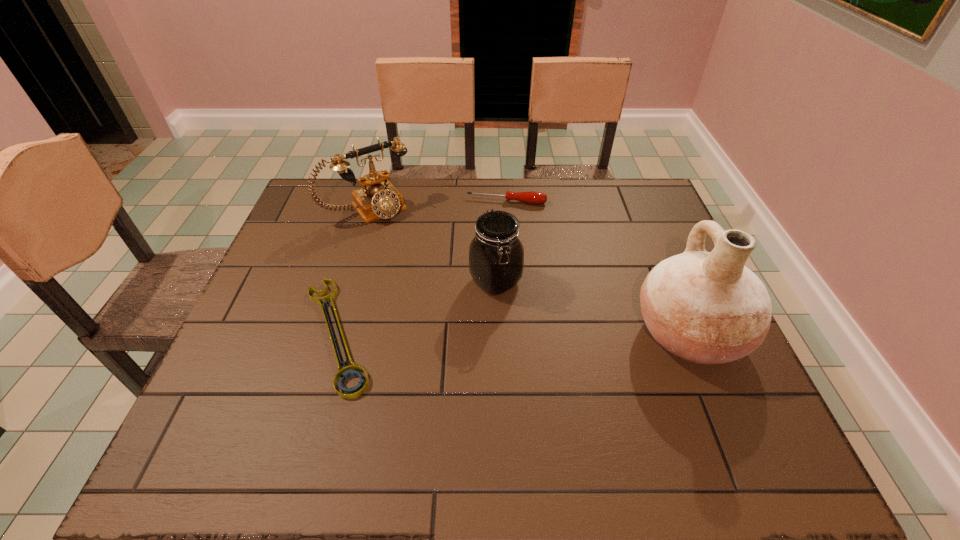
Select which object is the second closest to the tallest object. Please provide its 2D coordinates. Your answer should be formatted as a tuple, i.e. [(x, y)], where the tuple contains the x and y coordinates of a point satisfying the conditions above.

[(532, 197)]

Locate which object is the fourth closest to the pottery. Please provide its 2D coordinates. Your answer should be formatted as a tuple, i.e. [(x, y)], where the tuple contains the x and y coordinates of a point satisfying the conditions above.

[(378, 198)]

The image size is (960, 540). What are the coordinates of `free location that satisfies the following two spatial constraints: 1. on the front side of the telephone; 2. on the left side of the shortest object` in the screenshot? It's located at (330, 334).